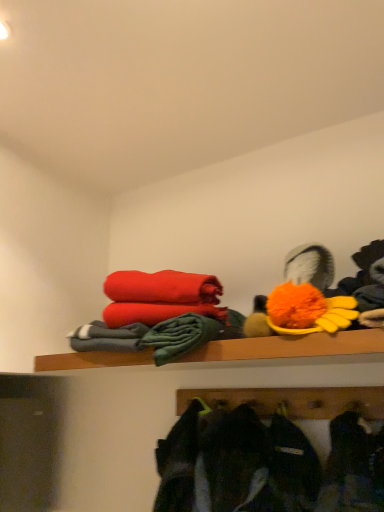
Question: Is point (264, 431) positioned closer to the camera than point (324, 350)?

Choices:
 (A) farther
 (B) closer

Answer: (A)

Question: Based on their positions, is dark gray fabric jacket at lower center located to the left or right of wooden shelf at upper center?

Choices:
 (A) right
 (B) left

Answer: (A)

Question: Which is farther from the fluffy orange pom-pom at upper right?

Choices:
 (A) dark gray fabric jacket at lower center
 (B) wooden shelf at upper center

Answer: (A)

Question: Which object is positioned closest to the dark gray fabric jacket at lower center?

Choices:
 (A) wooden shelf at upper center
 (B) fluffy orange pom-pom at upper right

Answer: (A)